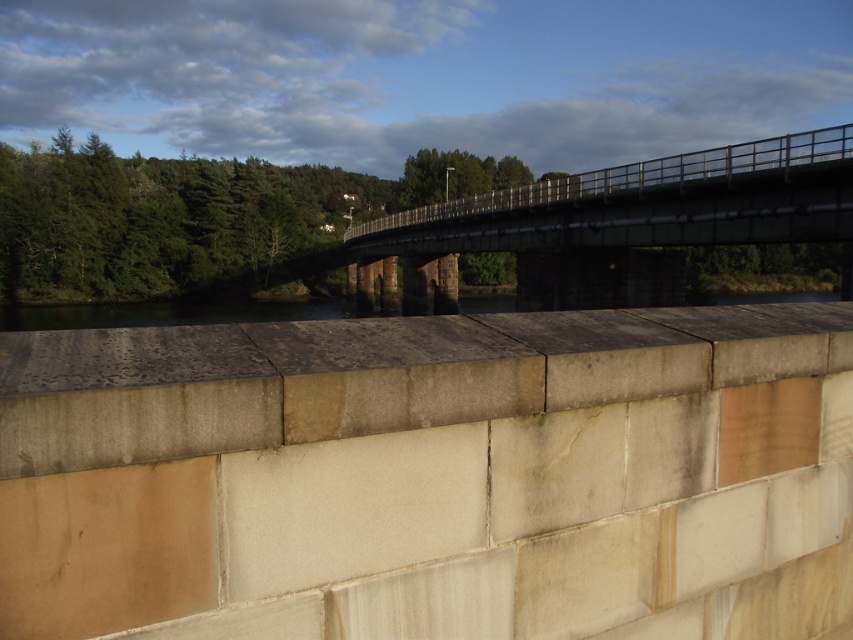
Between point (602, 362) and point (426, 253), which one is positioned behind?

Positioned behind is point (426, 253).

Measure the distance between smooth concrete ledge at center and camera.

smooth concrete ledge at center and camera are 5.47 feet apart from each other.

Is point (549, 339) positioned before point (547, 195)?

Yes, point (549, 339) is closer to viewer.

The width and height of the screenshot is (853, 640). I want to click on smooth concrete ledge at center, so click(x=374, y=376).